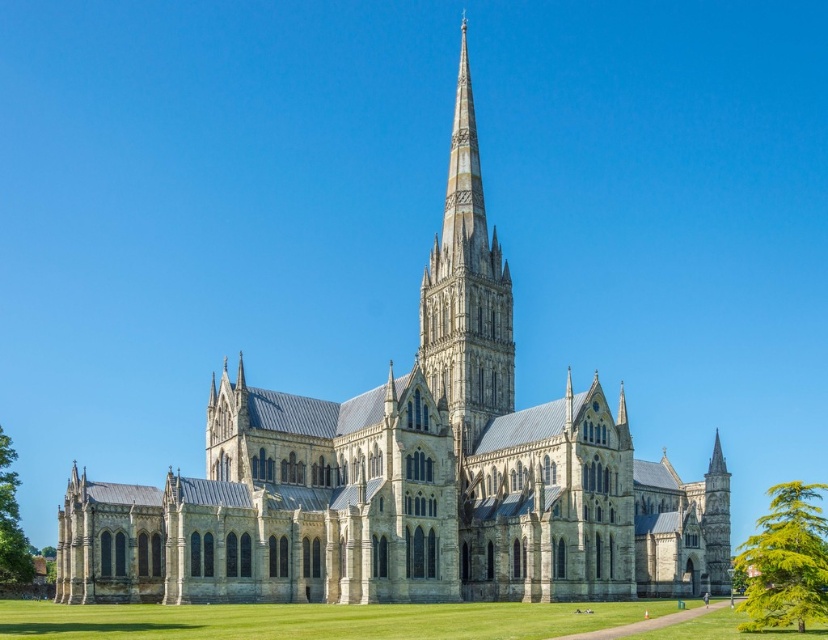
You are standing in front of Salisbury Cathedral and want to take a photo of the point at coordinates point (65, 611). Your camera has a minimum focus distance of 50 meters. Will you be able to focus on that point?

The point (65, 611) is 71.14 meters away from the camera, which is beyond the minimum focus distance of 50 meters. Therefore, the camera can focus on the point (65, 611) since it is within the focusing range.

You are an architect analyzing the Salisbury Cathedral image. You notice the gray stone spire at center and the green leafy tree at lower right. Which object appears higher in the image?

The gray stone spire at center is positioned over the green leafy tree at lower right, so it appears higher in the image.

You are standing in front of the Salisbury Cathedral and notice two points marked on the cathedral facade. The first point is at coordinates point (443, 252) and the second is at point (792, 595). Which of these two points is closer to your viewpoint?

Point (443, 252) is closer to your viewpoint because it is further to the camera than point (792, 595).